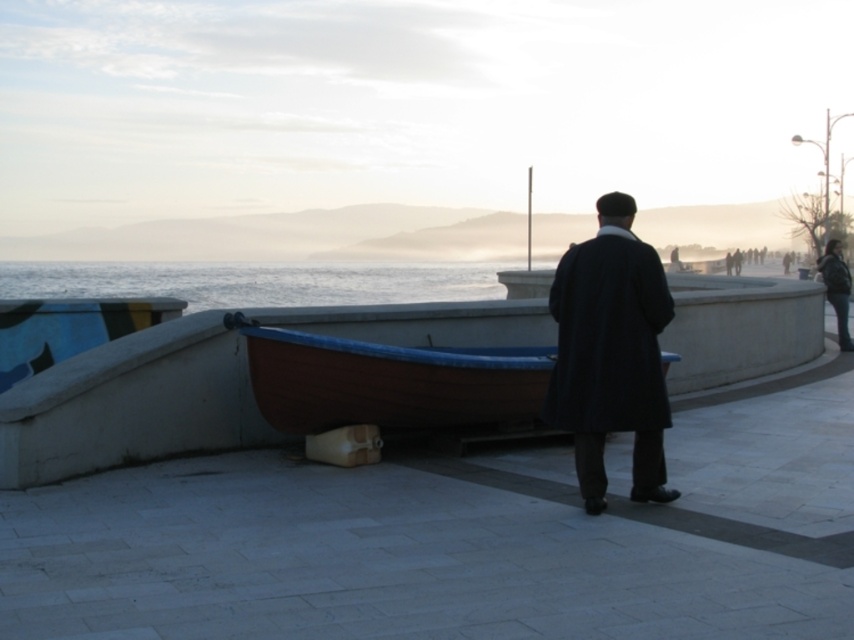
Question: Among these points, which one is farthest from the camera?

Choices:
 (A) (839, 292)
 (B) (656, 362)
 (C) (104, 262)

Answer: (C)

Question: Which object is the closest to the blue water at center?

Choices:
 (A) wooden canoe at center
 (B) black leather jacket at lower right

Answer: (A)

Question: Is the position of blue water at center more distant than that of black leather jacket at lower right?

Choices:
 (A) yes
 (B) no

Answer: (B)

Question: Which point is farther to the camera?

Choices:
 (A) (835, 285)
 (B) (445, 380)

Answer: (A)

Question: Is dark wool coat at center to the left of wooden canoe at center from the viewer's perspective?

Choices:
 (A) yes
 (B) no

Answer: (B)

Question: Where is wooden canoe at center located in relation to black leather jacket at lower right in the image?

Choices:
 (A) right
 (B) left

Answer: (B)